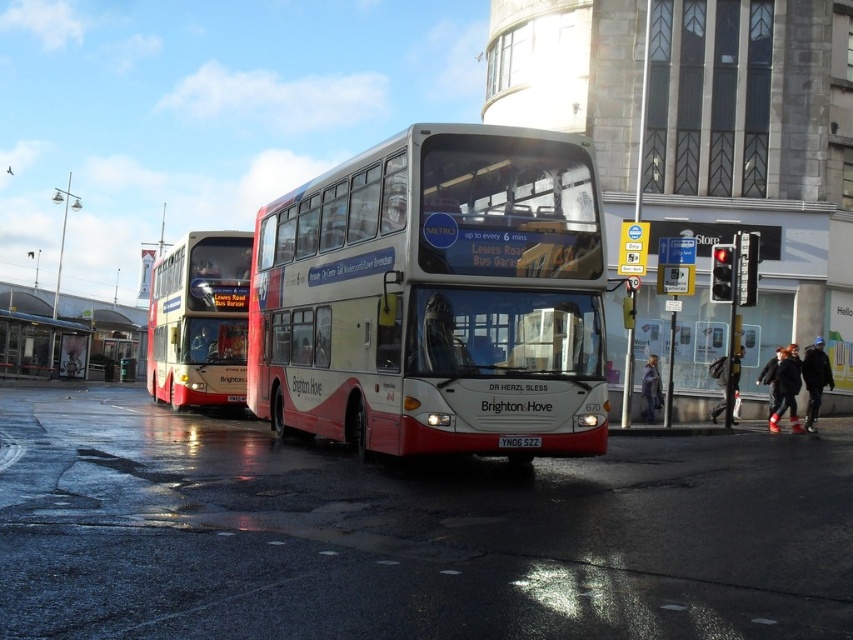
Is white glossy bus at center further to camera compared to matte red bus at left?

No, white glossy bus at center is closer to the viewer.

Which is behind, point (331, 404) or point (166, 307)?

The point (166, 307) is behind.

Identify the location of white glossy bus at center. Image resolution: width=853 pixels, height=640 pixels. (434, 298).

How much distance is there between matte red bus at left and yellow matte license plate at center?

matte red bus at left is 15.12 meters away from yellow matte license plate at center.

Identify the location of matte red bus at left. Image resolution: width=853 pixels, height=640 pixels. (199, 321).

Identify the location of matte red bus at left. Image resolution: width=853 pixels, height=640 pixels. (199, 321).

Between matte red bus at left and metallic bus stop at lower left, which one is positioned lower?

metallic bus stop at lower left

In order to click on matte red bus at left in this screenshot , I will do `click(199, 321)`.

Which is behind, point (204, 298) or point (16, 353)?

Point (16, 353)

Locate an element on the screen. The image size is (853, 640). matte red bus at left is located at coordinates (199, 321).